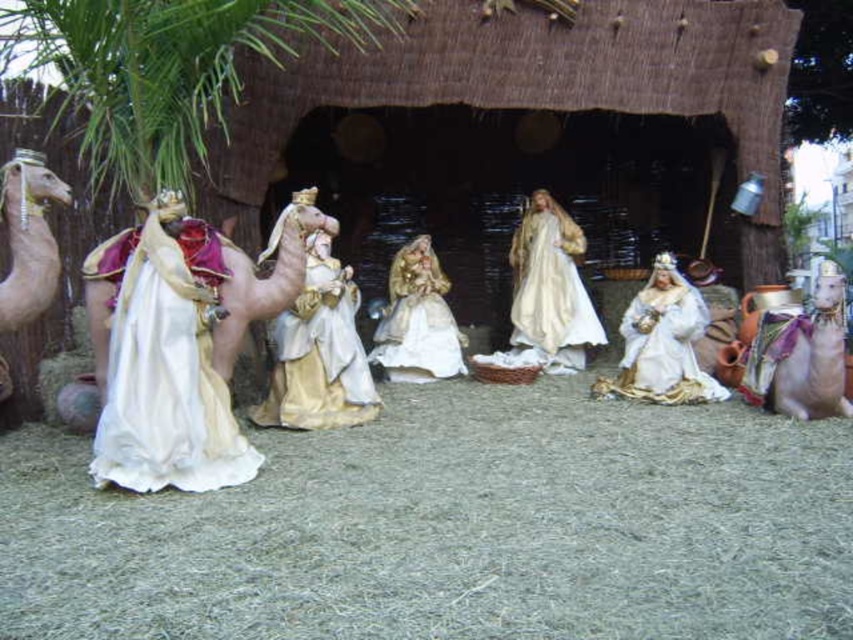
Does green leafy palm tree at upper left have a greater height compared to gold satin robe at center?

Correct, green leafy palm tree at upper left is much taller as gold satin robe at center.

Which of these two, green leafy palm tree at upper left or gold satin robe at center, stands shorter?

With less height is gold satin robe at center.

Identify the location of green leafy palm tree at upper left. Image resolution: width=853 pixels, height=640 pixels. (171, 67).

Describe the element at coordinates (550, 288) in the screenshot. I see `white satin robe at center` at that location.

Who is shorter, white satin robe at center or white satin crown at center?

white satin crown at center

Find the location of `white satin robe at center`. white satin robe at center is located at coordinates (550, 288).

At what (x,y) coordinates should I click in order to perform the action: click on white satin robe at center. Please return your answer as a coordinate pair (x, y). The image size is (853, 640). Looking at the image, I should click on (550, 288).

Is white satin dress at left taller than gold satin dress at center?

Yes, white satin dress at left is taller than gold satin dress at center.

Does white satin dress at left have a greater width compared to gold satin dress at center?

Correct, the width of white satin dress at left exceeds that of gold satin dress at center.

What do you see at coordinates (164, 358) in the screenshot? This screenshot has width=853, height=640. I see `white satin dress at left` at bounding box center [164, 358].

I want to click on white satin dress at left, so click(164, 358).